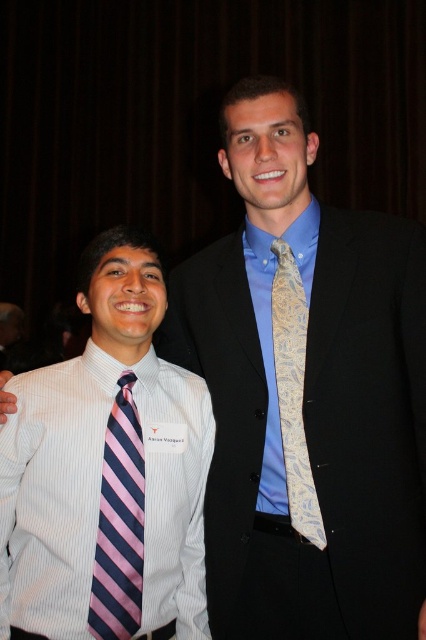
Question: Considering the real-world distances, which object is farthest from the light blue paisley tie at center?

Choices:
 (A) white striped dress shirt at left
 (B) pink striped tie at left
 (C) silky blue shirt at center

Answer: (B)

Question: Which object appears farthest from the camera in this image?

Choices:
 (A) light blue paisley tie at center
 (B) white striped dress shirt at left

Answer: (A)

Question: Considering the relative positions of silky blue shirt at center and pink striped tie at left in the image provided, where is silky blue shirt at center located with respect to pink striped tie at left?

Choices:
 (A) right
 (B) left

Answer: (A)

Question: Which object is closer to the camera taking this photo?

Choices:
 (A) pink striped tie at left
 (B) light blue paisley tie at center

Answer: (A)

Question: Is white striped dress shirt at left thinner than pink striped tie at left?

Choices:
 (A) yes
 (B) no

Answer: (B)

Question: Can you confirm if white striped dress shirt at left is thinner than pink striped tie at left?

Choices:
 (A) yes
 (B) no

Answer: (B)